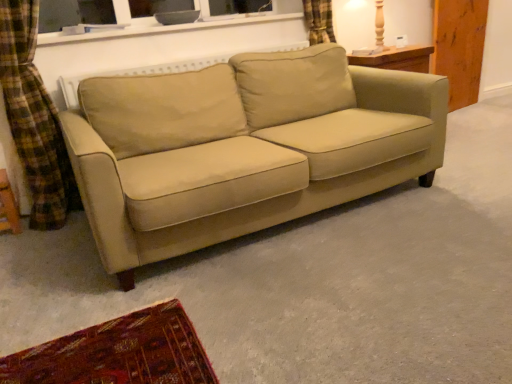
Question: In terms of width, does beige fabric couch at center look wider or thinner when compared to wooden table lamp at upper right?

Choices:
 (A) thin
 (B) wide

Answer: (B)

Question: Considering their positions, is beige fabric couch at center located in front of or behind wooden table lamp at upper right?

Choices:
 (A) front
 (B) behind

Answer: (A)

Question: From a real-world perspective, is beige fabric couch at center physically located above or below wooden table lamp at upper right?

Choices:
 (A) below
 (B) above

Answer: (A)

Question: In terms of height, does wooden table lamp at upper right look taller or shorter compared to beige fabric couch at center?

Choices:
 (A) tall
 (B) short

Answer: (B)

Question: Do you think wooden table lamp at upper right is within beige fabric couch at center, or outside of it?

Choices:
 (A) inside
 (B) outside

Answer: (B)

Question: Does point (366, 3) appear closer or farther from the camera than point (92, 170)?

Choices:
 (A) closer
 (B) farther

Answer: (B)

Question: Is wooden table lamp at upper right wider or thinner than beige fabric couch at center?

Choices:
 (A) thin
 (B) wide

Answer: (A)